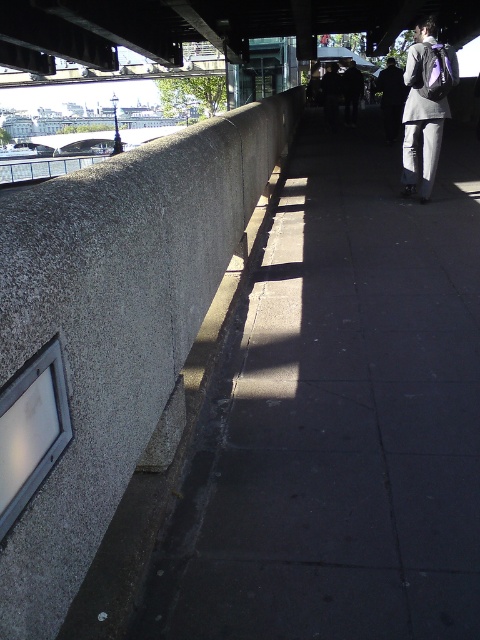
Between gray concrete pavement at center and gray concrete ledge at left, which one has less height?

Standing shorter between the two is gray concrete ledge at left.

Can you confirm if gray concrete pavement at center is bigger than gray concrete ledge at left?

Correct, gray concrete pavement at center is larger in size than gray concrete ledge at left.

The image size is (480, 640). Identify the location of gray concrete pavement at center. (339, 417).

Can you confirm if gray concrete pavement at center is smaller than gray fabric backpack at right?

Actually, gray concrete pavement at center might be larger than gray fabric backpack at right.

Between point (450, 481) and point (422, 108), which one is positioned behind?

Point (422, 108)

Where is `gray concrete pavement at center`? The height and width of the screenshot is (640, 480). gray concrete pavement at center is located at coordinates (339, 417).

The width and height of the screenshot is (480, 640). Find the location of `gray concrete pavement at center`. gray concrete pavement at center is located at coordinates (339, 417).

Between gray concrete ledge at left and gray fabric backpack at right, which one is positioned lower?

Positioned lower is gray concrete ledge at left.

Between point (58, 214) and point (418, 22), which one is positioned behind?

The point (418, 22) is behind.

Between point (140, 445) and point (435, 67), which one is positioned in front?

Point (140, 445)

Where is `gray concrete ledge at left`? The image size is (480, 640). gray concrete ledge at left is located at coordinates (117, 321).